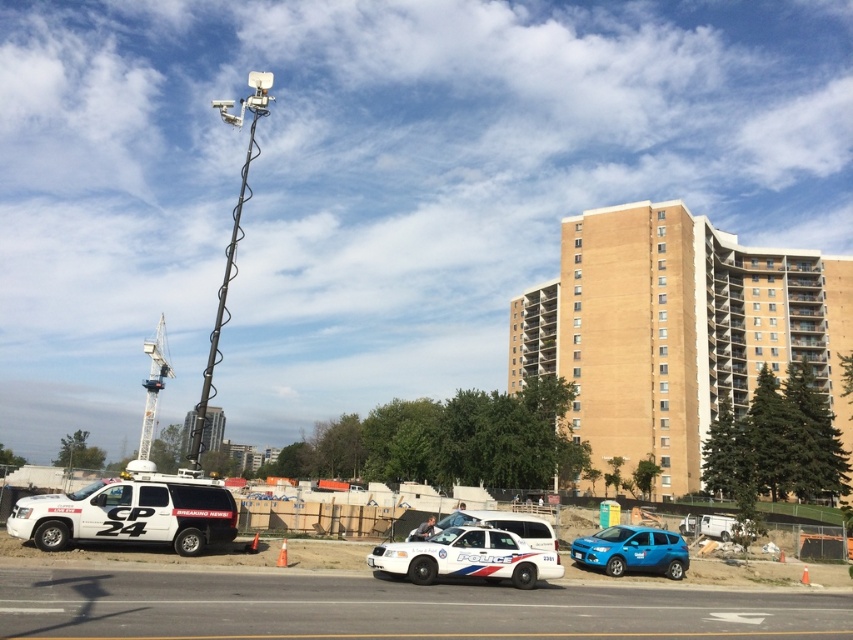
Based on the photo, you are a delivery driver trying to navigate through the scene. There is a white matte van at center and a white metallic crane at upper left. Which object is closer to you as you approach the scene from the front?

The white matte van at center is closer to you because it is in front of the white metallic crane at upper left.

You are a drone operator trying to capture aerial footage of the scene. You have two points marked on your map as reference points. The first point is at coordinates point [47,493] and the second at point [579,550]. If you want to fly your drone from the first point to the second point, will the drone pass over the residential building in the background?

Point [47,493] is behind point [579,550], so flying from the first point to the second point would mean moving towards the foreground away from the residential building. Therefore, the drone will not pass over the residential building in the background.